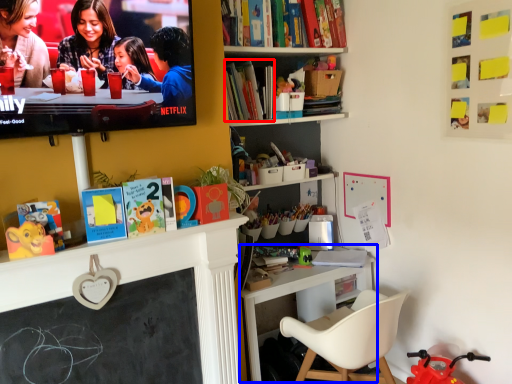
Question: Which object appears farthest to the camera in this image, book (highlighted by a red box) or table (highlighted by a blue box)?

Choices:
 (A) book
 (B) table

Answer: (A)